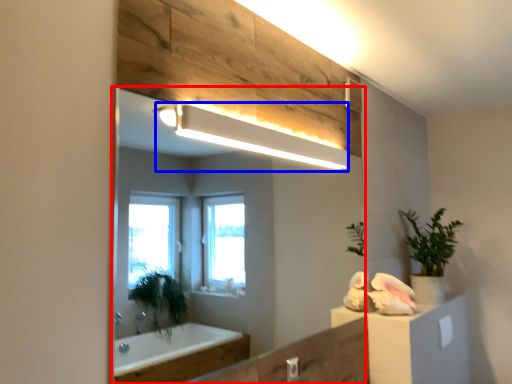
Question: Which point is closer to the camera, mirror (highlighted by a red box) or light fixture (highlighted by a blue box)?

Choices:
 (A) mirror
 (B) light fixture

Answer: (A)